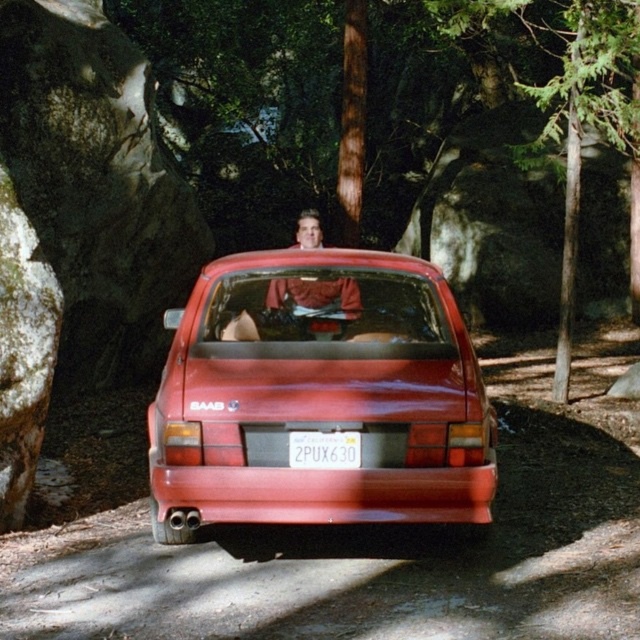
Can you confirm if glossy red car at center is wider than smooth leather jacket at center?

Yes.

Is point (177, 426) closer to camera compared to point (317, 282)?

Yes.

I want to click on glossy red car at center, so (317, 396).

Does glossy red car at center have a greater width compared to white plastic license plate at center?

Correct, the width of glossy red car at center exceeds that of white plastic license plate at center.

Does glossy red car at center have a smaller size compared to white plastic license plate at center?

Actually, glossy red car at center might be larger than white plastic license plate at center.

Is point (209, 339) positioned before point (355, 440)?

No.

Find the location of `glossy red car at center`. glossy red car at center is located at coordinates (317, 396).

Can you confirm if smooth leather jacket at center is positioned to the left of white plastic license plate at center?

Correct, you'll find smooth leather jacket at center to the left of white plastic license plate at center.

Which of these two, smooth leather jacket at center or white plastic license plate at center, stands taller?

Standing taller between the two is smooth leather jacket at center.

This screenshot has height=640, width=640. What do you see at coordinates (316, 300) in the screenshot? I see `smooth leather jacket at center` at bounding box center [316, 300].

The width and height of the screenshot is (640, 640). I want to click on smooth leather jacket at center, so click(x=316, y=300).